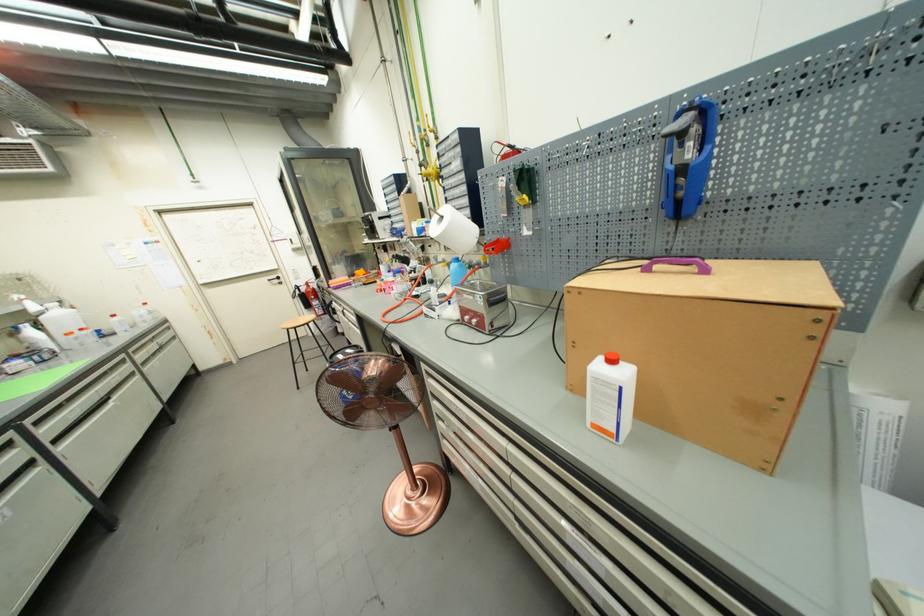
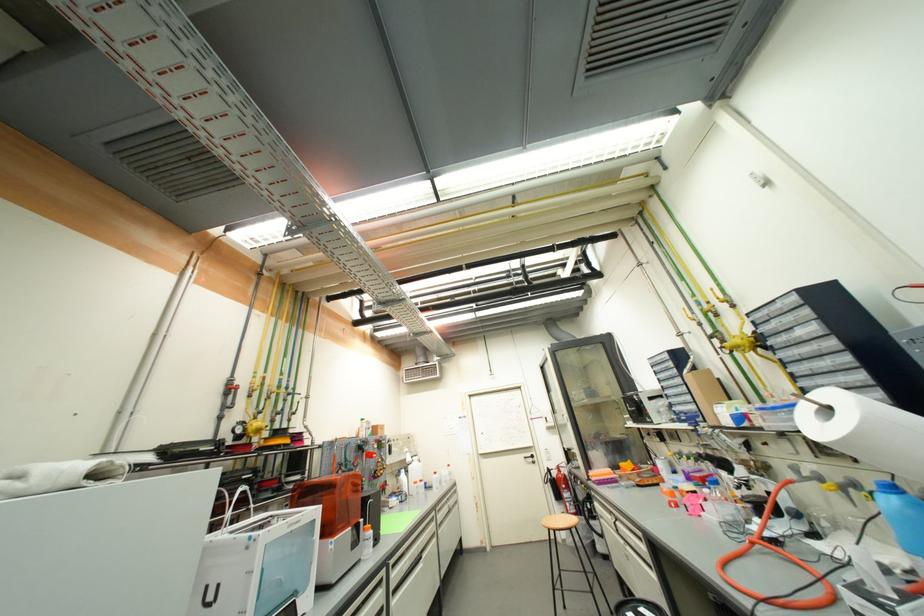
Where in the second image is the point corresponding to (x=424, y=308) from the first image?

(817, 578)